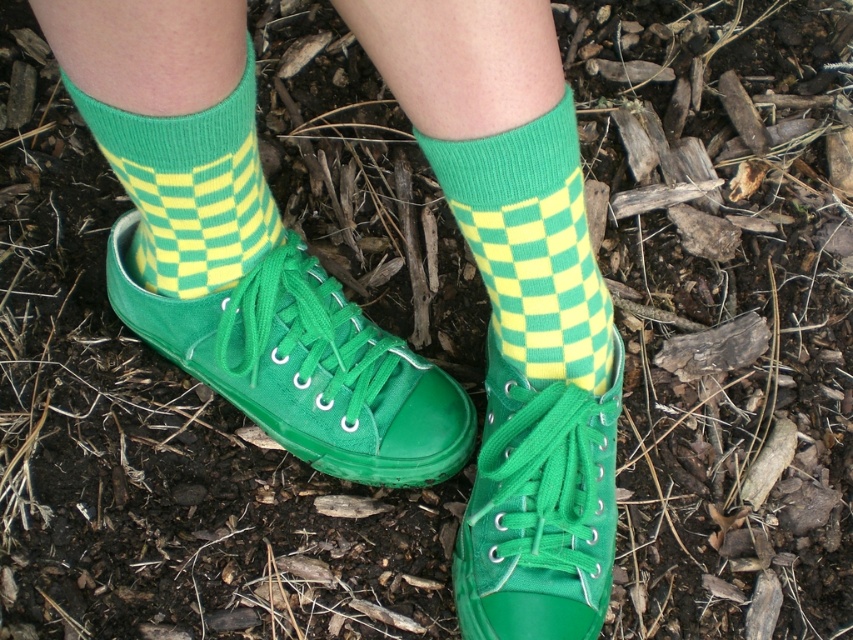
You are a photographer trying to capture a detailed closeup of the green rubber shoe at center. Your camera has a minimum focusing distance of 1 meter. Can you take the photo without moving closer than 1 meter?

The green rubber shoe at center is 1.23 meters away from camera, so yes, you can take the photo without moving closer than 1 meter since the distance is sufficient for the camera to focus.

You are trying to decide which pair of shoes to wear for a hike. You see the green canvas shoes at center and the green rubber shoe at center in the image. Which one has a bigger size?

The green canvas shoes at center are larger in size than the green rubber shoe at center according to the description.

You are a fashion designer trying to create a pair of matching socks for a client who wants them to be close together. The client has two socks in their collection, the green checkered sock at center and the green knitted sock at center. Based on the image, can you determine if these two socks are positioned close enough to each other to be considered a matching pair?

The green checkered sock at center and the green knitted sock at center are 39.15 centimeters apart, which is a significant distance. Therefore, they are not positioned close enough to be considered a matching pair.